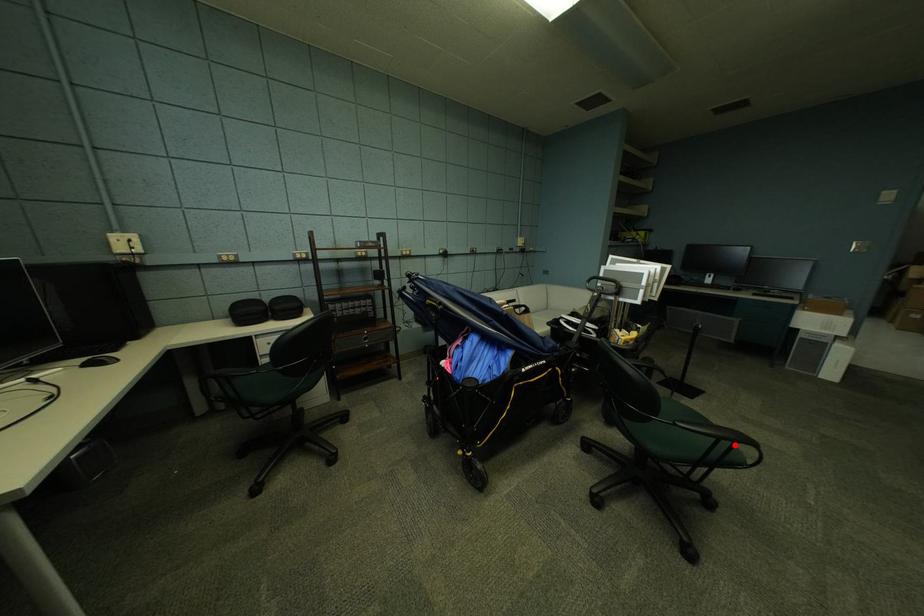
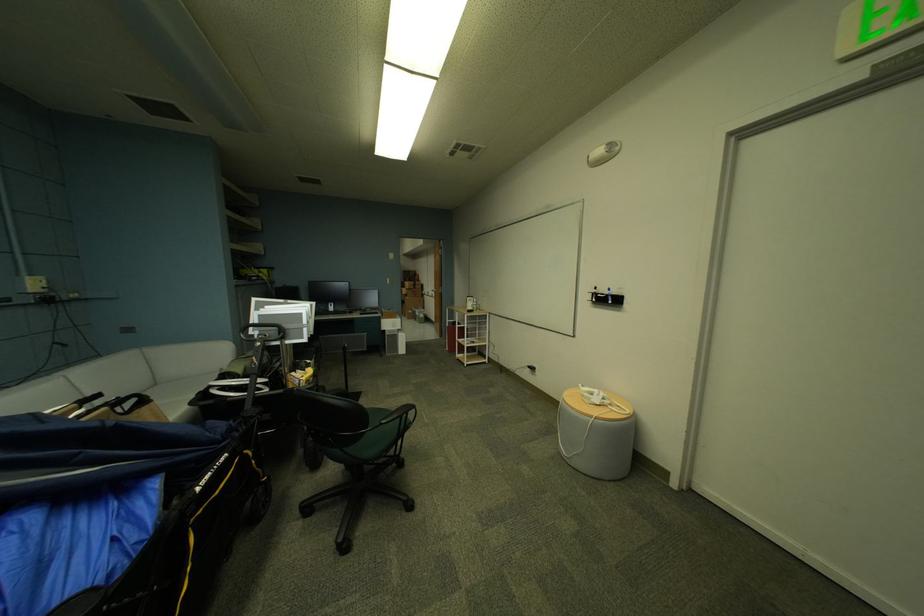
Question: I am providing you with two images of the same scene from different viewpoints. Image1 has a red point marked. In image2, the corresponding 3D location appears at what relative position? Reply with the corresponding letter.

Choices:
 (A) Closer
 (B) Farther

Answer: (A)